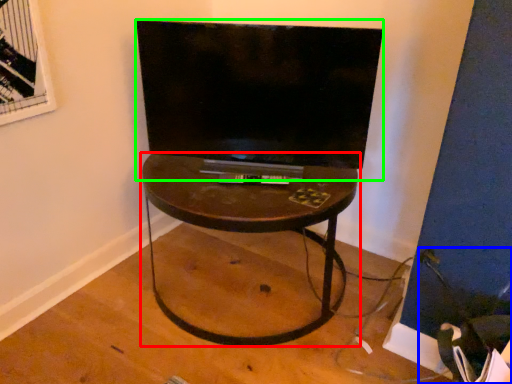
Question: Considering the real-world distances, which object is farthest from table (highlighted by a red box)? swivel chair (highlighted by a blue box) or television (highlighted by a green box)?

Choices:
 (A) swivel chair
 (B) television

Answer: (A)